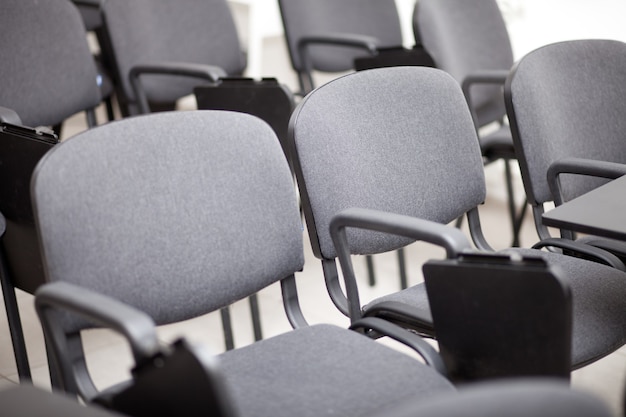
I want to click on arm rests on chairs, so click(183, 70), click(346, 40), click(496, 76), click(587, 164), click(444, 230), click(120, 318).